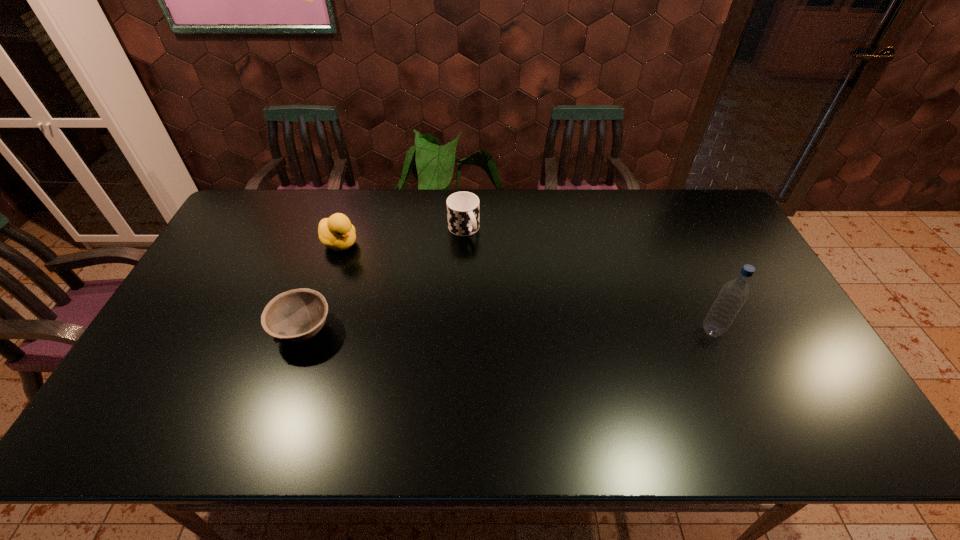
The width and height of the screenshot is (960, 540). Identify the location of object that is the second closest one to the shortest object. (462, 207).

Locate an element on the screen. blank area in the image that satisfies the following two spatial constraints: 1. on the back side of the shortest object; 2. on the left side of the water bottle is located at coordinates (303, 330).